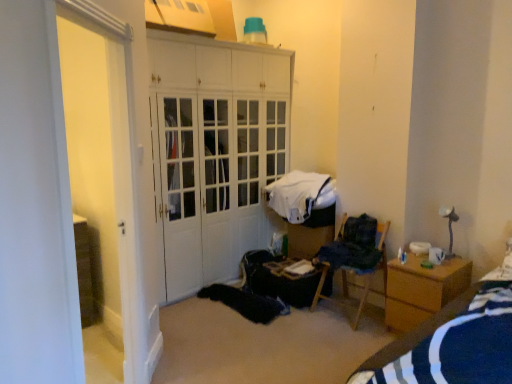
The height and width of the screenshot is (384, 512). Identify the location of white fabric at center, arranged as the second clothing when viewed from the front. (300, 195).

What do you see at coordinates (353, 245) in the screenshot? This screenshot has height=384, width=512. I see `dark blue fabric at right, positioned as the 1th clothing in front-to-back order` at bounding box center [353, 245].

The width and height of the screenshot is (512, 384). What do you see at coordinates (214, 152) in the screenshot?
I see `white glossy cabinet at center` at bounding box center [214, 152].

I want to click on white fabric at center, arranged as the second clothing when viewed from the front, so click(x=300, y=195).

Which of these two, white glossy door at left or white fabric at center, the first clothing from the back, stands taller?

white glossy door at left is taller.

Based on the photo, which object is further away from the camera, white glossy door at left or white fabric at center, arranged as the second clothing when viewed from the front?

white fabric at center, arranged as the second clothing when viewed from the front, is further away from the camera.

Does white glossy door at left have a smaller size compared to white fabric at center, arranged as the second clothing when viewed from the front?

No.

Which of these two, wooden chair at center or blue striped fabric at lower right, stands taller?

Standing taller between the two is blue striped fabric at lower right.

How distant is wooden chair at center from blue striped fabric at lower right?

The distance of wooden chair at center from blue striped fabric at lower right is 4.02 feet.

From the image's perspective, is wooden chair at center beneath blue striped fabric at lower right?

No, from the image's perspective, wooden chair at center is not beneath blue striped fabric at lower right.

Is wooden chair at center positioned far away from blue striped fabric at lower right?

Yes, wooden chair at center is far from blue striped fabric at lower right.

Is wooden table at center wider than dark blue fabric at right, the second clothing from the back?

Indeed, wooden table at center has a greater width compared to dark blue fabric at right, the second clothing from the back.

Is wooden table at center closer to camera compared to dark blue fabric at right, positioned as the 1th clothing in front-to-back order?

No, it is not.

Considering the sizes of objects wooden table at center and dark blue fabric at right, the second clothing from the back, in the image provided, who is smaller, wooden table at center or dark blue fabric at right, the second clothing from the back,?

Smaller between the two is dark blue fabric at right, the second clothing from the back.

Does point (396, 293) lie behind point (381, 249)?

No, (396, 293) is closer to viewer.

Which object is positioned more to the left, wooden nightstand at right or wooden chair at center?

wooden chair at center is more to the left.

Considering the sizes of wooden nightstand at right and wooden chair at center in the image, is wooden nightstand at right taller or shorter than wooden chair at center?

In the image, wooden nightstand at right appears to be shorter than wooden chair at center.

From the image's perspective, is wooden nightstand at right over wooden chair at center?

Actually, wooden nightstand at right appears below wooden chair at center in the image.

From the image's perspective, would you say blue striped fabric at lower right is shown under wooden table at center?

No.

From the picture: Is the depth of blue striped fabric at lower right less than that of wooden table at center?

Yes, it is.

How much distance is there between blue striped fabric at lower right and wooden table at center?

blue striped fabric at lower right is 1.67 meters away from wooden table at center.

Considering the relative sizes of blue striped fabric at lower right and dark blue fabric at right, positioned as the 1th clothing in front-to-back order, in the image provided, is blue striped fabric at lower right shorter than dark blue fabric at right, positioned as the 1th clothing in front-to-back order,?

Incorrect, the height of blue striped fabric at lower right does not fall short of that of dark blue fabric at right, positioned as the 1th clothing in front-to-back order.

Is blue striped fabric at lower right positioned beyond the bounds of dark blue fabric at right, the second clothing from the back?

blue striped fabric at lower right is positioned outside dark blue fabric at right, the second clothing from the back.

Which object is positioned more to the right, blue striped fabric at lower right or dark blue fabric at right, the second clothing from the back?

Positioned to the right is blue striped fabric at lower right.

From a real-world perspective, which is physically above, white fabric at center, the first clothing from the back, or wooden chair at center?

white fabric at center, the first clothing from the back, from a real-world perspective.

From a real-world perspective, count 2nd clothings upward from the wooden chair at center and point to it. Please provide its 2D coordinates.

[(300, 195)]

Measure the distance from white fabric at center, the first clothing from the back, to wooden chair at center.

white fabric at center, the first clothing from the back, and wooden chair at center are 26.20 inches apart.

In the scene shown: From the image's perspective, is white fabric at center, arranged as the second clothing when viewed from the front, on top of wooden chair at center?

Correct, white fabric at center, arranged as the second clothing when viewed from the front, appears higher than wooden chair at center in the image.

Where is `clothing that is the 1st one when counting rightward from the white glossy door at left`? clothing that is the 1st one when counting rightward from the white glossy door at left is located at coordinates (300, 195).

At what (x,y) coordinates should I click in order to perform the action: click on bed above the wooden chair at center (from a real-world perspective). Please return your answer as a coordinate pair (x, y). The image size is (512, 384). Looking at the image, I should click on (452, 344).

Looking at the image, which one is located further to white glossy cabinet at center, blue striped fabric at lower right or wooden table at center?

The object further to white glossy cabinet at center is blue striped fabric at lower right.

Based on their spatial positions, is wooden nightstand at right or wooden chair at center closer to wooden table at center?

Among the two, wooden chair at center is located nearer to wooden table at center.

From the image, which object appears to be nearer to blue striped fabric at lower right, white fabric at center, the first clothing from the back, or white glossy door at left?

white glossy door at left is positioned closer to the anchor blue striped fabric at lower right.

Considering their positions, is wooden nightstand at right positioned closer to blue striped fabric at lower right than white fabric at center, the first clothing from the back?

Based on the image, wooden nightstand at right appears to be nearer to blue striped fabric at lower right.

Which object lies further to the anchor point dark blue fabric at right, the second clothing from the back, blue striped fabric at lower right or wooden chair at center?

Among the two, blue striped fabric at lower right is located further to dark blue fabric at right, the second clothing from the back.

Considering their positions, is white fabric at center, the first clothing from the back, positioned further to wooden table at center than white glossy cabinet at center?

white glossy cabinet at center lies further to wooden table at center than the other object.

Estimate the real-world distances between objects in this image. Which object is further from blue striped fabric at lower right, wooden table at center or white glossy door at left?

Based on the image, white glossy door at left appears to be further to blue striped fabric at lower right.

From the image, which object appears to be farther from dark blue fabric at right, the second clothing from the back, white fabric at center, the first clothing from the back, or white glossy cabinet at center?

Based on the image, white glossy cabinet at center appears to be further to dark blue fabric at right, the second clothing from the back.

Identify the location of chair between white glossy door at left and white fabric at center, the first clothing from the back, in the front-back direction. The image size is (512, 384). (382, 251).

Locate an element on the screen. The image size is (512, 384). chair between wooden table at center and dark blue fabric at right, the second clothing from the back, in the horizontal direction is located at coordinates (382, 251).

You are a GUI agent. You are given a task and a screenshot of the screen. Output one action in this format:
    pyautogui.click(x=<x>, y=<y>)
    Task: Click on the chair located between blue striped fabric at lower right and dark blue fabric at right, the second clothing from the back, in the depth direction
    
    Given the screenshot: What is the action you would take?
    pyautogui.click(x=382, y=251)

Find the location of `chair between wooden table at center and wooden nightstand at right from left to right`. chair between wooden table at center and wooden nightstand at right from left to right is located at coordinates (382, 251).